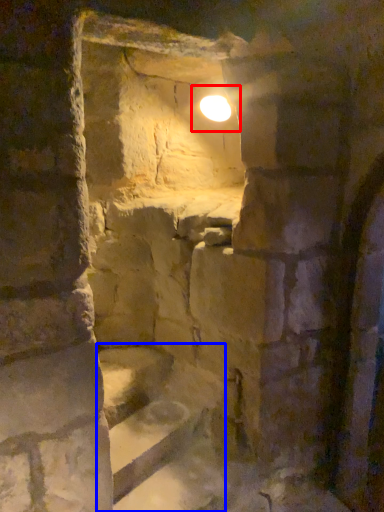
Question: Which of the following is the farthest to the observer, light (highlighted by a red box) or stairs (highlighted by a blue box)?

Choices:
 (A) light
 (B) stairs

Answer: (A)